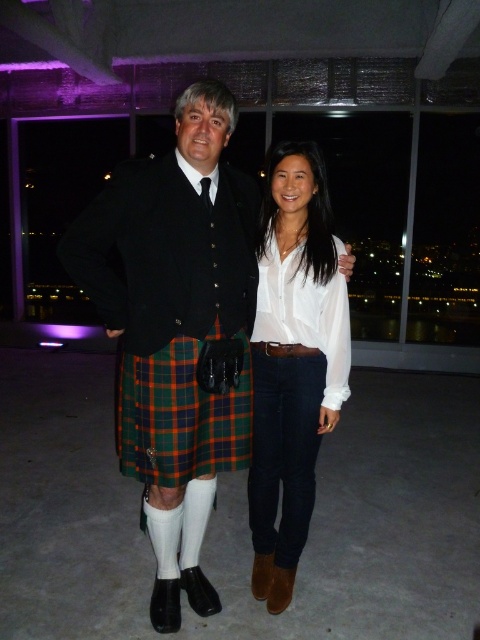
Is point (335, 396) positioned before point (216, 419)?

That is False.

Is white satin blouse at center shorter than plaid fabric kilt at center?

In fact, white satin blouse at center may be taller than plaid fabric kilt at center.

Does point (309, 307) come in front of point (120, 403)?

No, it is not.

Locate an element on the screen. This screenshot has width=480, height=640. white satin blouse at center is located at coordinates click(292, 362).

Is tartan kilt at center taller than white satin blouse at center?

Yes.

Between point (139, 300) and point (277, 323), which one is positioned in front?

Point (139, 300) is in front.

Identify the location of tartan kilt at center. (177, 330).

This screenshot has height=640, width=480. I want to click on tartan kilt at center, so click(x=177, y=330).

Measure the distance between point (x=108, y=228) and camera.

Point (x=108, y=228) is 5.53 feet away from camera.

At what (x,y) coordinates should I click in order to perform the action: click on tartan kilt at center. Please return your answer as a coordinate pair (x, y). This screenshot has height=640, width=480. Looking at the image, I should click on (177, 330).